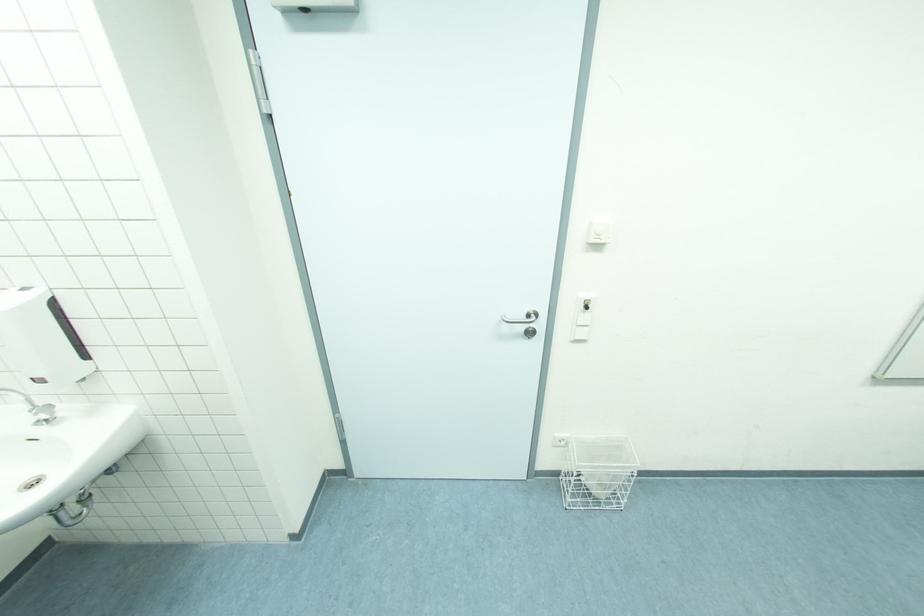
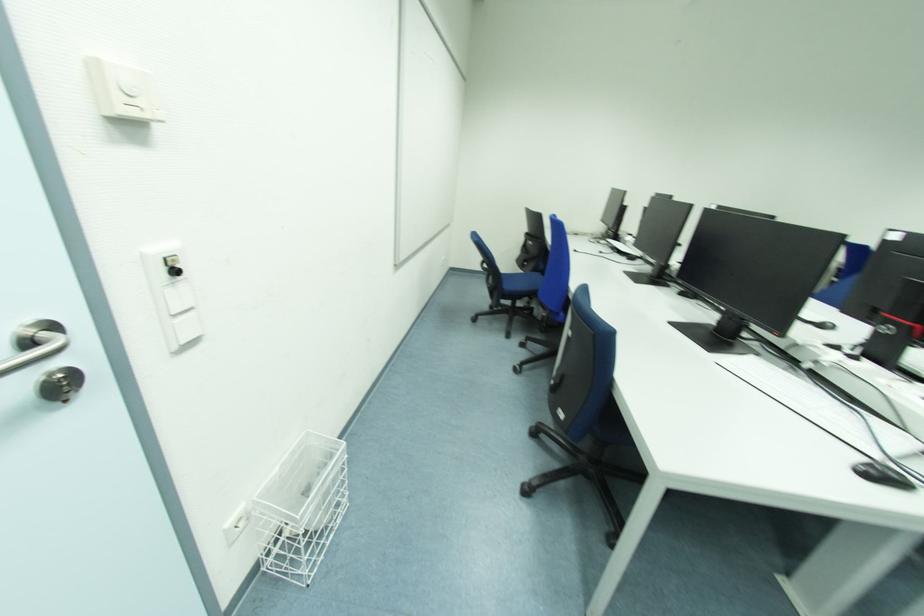
Locate, in the second image, the point that corresponds to point (535, 315) in the first image.

(50, 334)